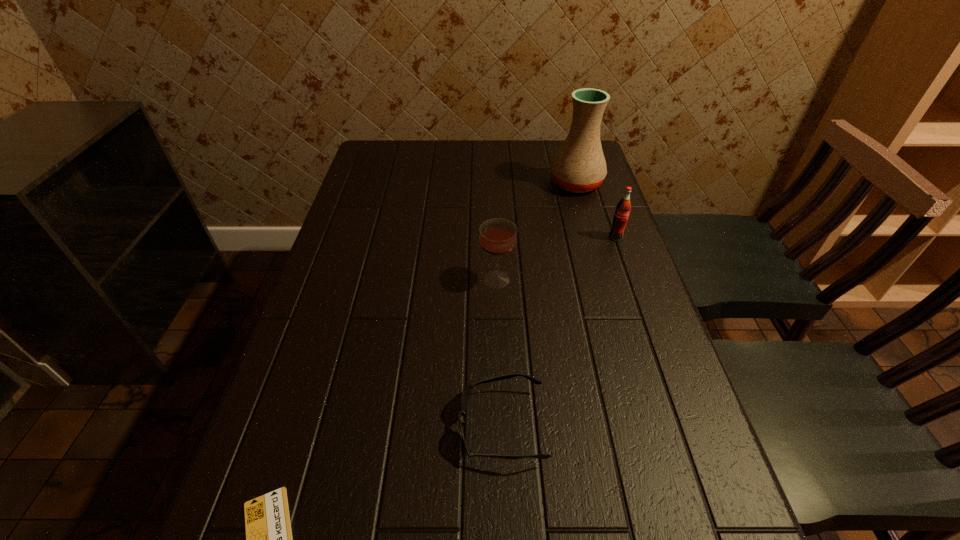
Identify the location of free spot located on the lenses of the fourth tallest object. The image size is (960, 540). (348, 426).

The height and width of the screenshot is (540, 960). Identify the location of vacant space located on the lenses of the fourth tallest object. (371, 426).

In order to click on object situated at the far edge in this screenshot , I will do click(x=579, y=166).

At what (x,y) coordinates should I click in order to perform the action: click on pottery positioned at the right edge. Please return your answer as a coordinate pair (x, y). Looking at the image, I should click on (579, 166).

Identify the location of soda bottle located in the right edge section of the desktop. (623, 208).

In order to click on object that is positioned at the far right corner in this screenshot , I will do `click(579, 166)`.

The width and height of the screenshot is (960, 540). I want to click on vacant region at the far edge of the desktop, so click(529, 156).

Where is `vacant space at the left edge of the desktop`? vacant space at the left edge of the desktop is located at coordinates (312, 316).

In the image, there is a desktop. Identify the location of free space at the right edge. pyautogui.click(x=594, y=347).

At what (x,y) coordinates should I click in order to perform the action: click on vacant space at the far left corner. Please return your answer as a coordinate pair (x, y). Looking at the image, I should click on (396, 160).